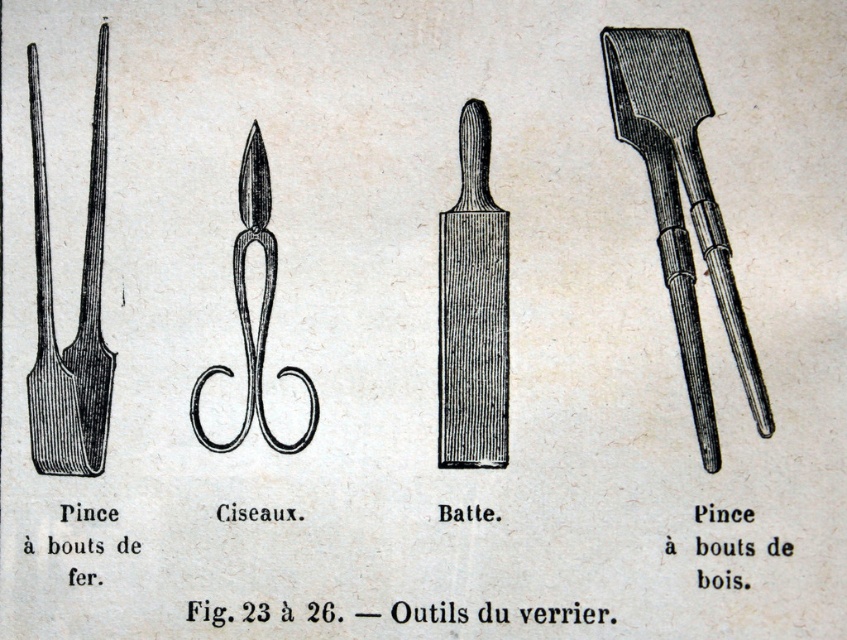
You are an apprentice glassmaker examining the illustration of the tools. The wooden tongs at right are positioned at a specific coordinate. Which tool is located at the coordinate point mentioned in the scene?

The wooden tongs at right are located at the coordinate point mentioned in the scene, which is at point (x=679, y=205).

You are a glassmaker needing to choose between the wooden tongs at right and the matte black tongs at left for handling a large piece of glass. Which tool should you select based on their widths?

You should select the wooden tongs at right because their width is larger than the matte black tongs at left, making them more suitable for handling larger pieces of glass.